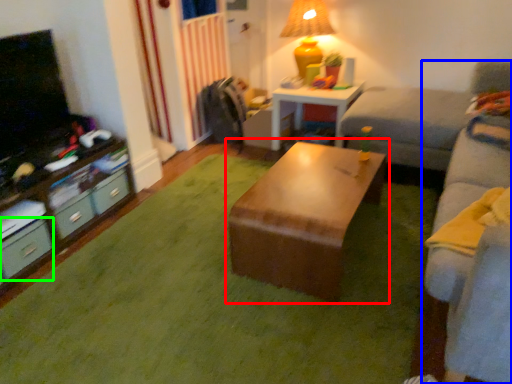
Question: Based on their relative distances, which object is nearer to table (highlighted by a red box)? Choose from studio couch (highlighted by a blue box) and drawer (highlighted by a green box).

Choices:
 (A) studio couch
 (B) drawer

Answer: (A)